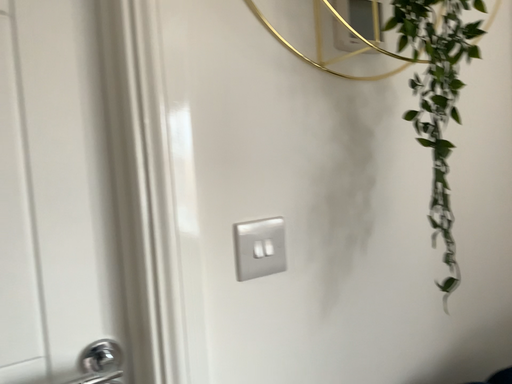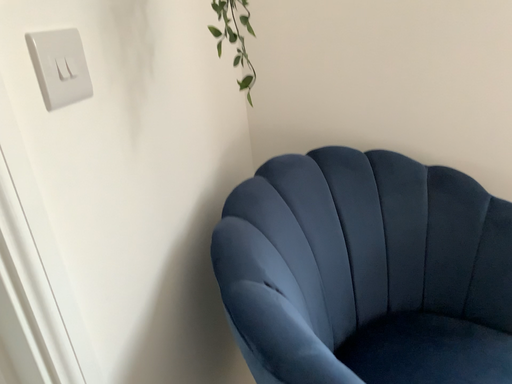
Question: How did the camera likely rotate when shooting the video?

Choices:
 (A) rotated right
 (B) rotated left

Answer: (A)